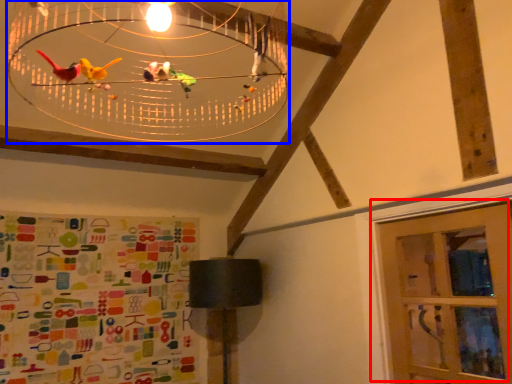
Question: Which of the following is the farthest to the observer, door (highlighted by a red box) or chandelier (highlighted by a blue box)?

Choices:
 (A) door
 (B) chandelier

Answer: (A)